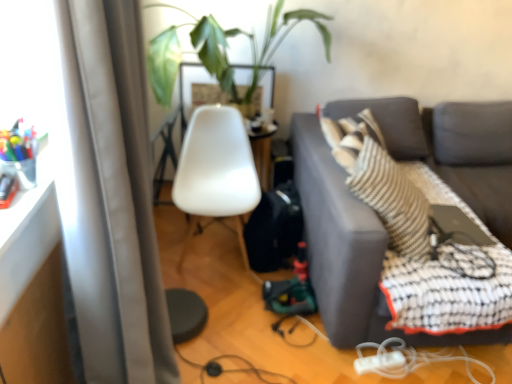
The height and width of the screenshot is (384, 512). Find the location of `vacant area that lies to the right of white plastic extension cord at lower center`. vacant area that lies to the right of white plastic extension cord at lower center is located at coordinates (412, 367).